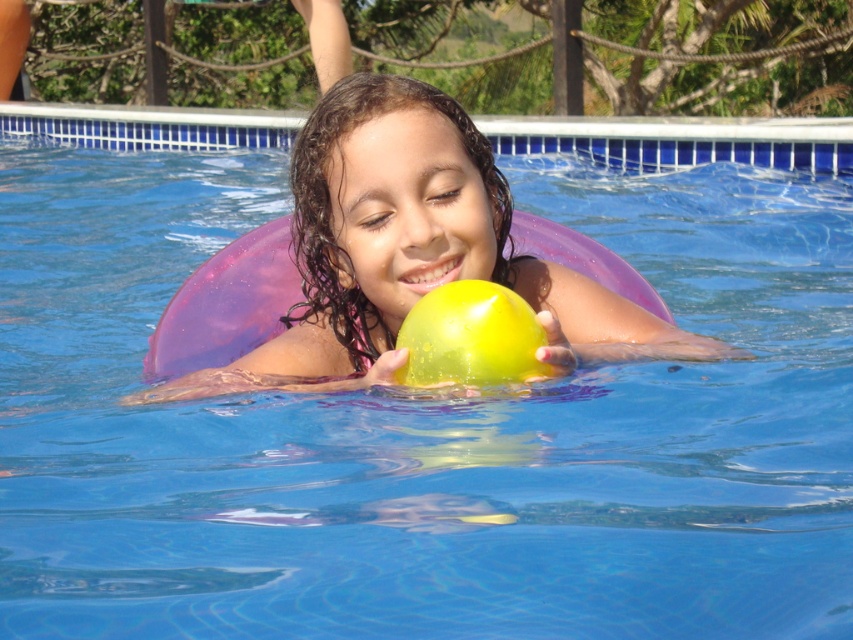
From the picture: You are a photographer aiming to capture a closeup of the child in the swimming pool. You have two points marked in the image for focus adjustment. The first point is at coordinates point (306, 244) and the second is at point (450, 298). Which point should you choose to ensure the child is in focus?

Point (306, 244) is further to the camera than point (450, 298), so choosing point (306, 244) will ensure the child is in focus because it is closer to the camera.